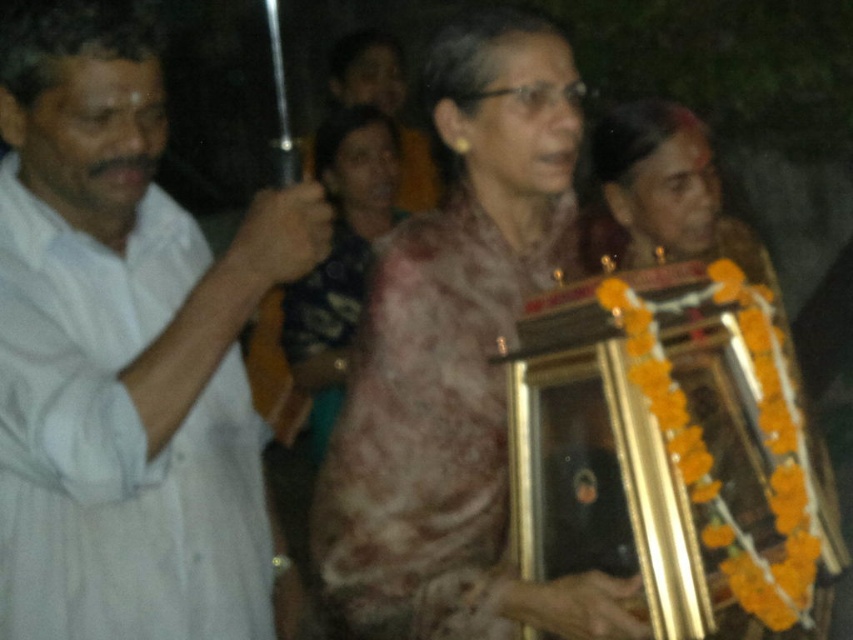
Can you confirm if white cotton shirt at left is positioned to the left of matte pink saree at center?

Yes, white cotton shirt at left is to the left of matte pink saree at center.

Which of these two, white cotton shirt at left or matte pink saree at center, stands taller?

With more height is matte pink saree at center.

Identify the location of white cotton shirt at left. (125, 349).

Locate an element on the screen. white cotton shirt at left is located at coordinates [125, 349].

Does white cotton shirt at left have a smaller size compared to pink floral sari at center?

Actually, white cotton shirt at left might be larger than pink floral sari at center.

Who is lower down, white cotton shirt at left or pink floral sari at center?

white cotton shirt at left is below.

The width and height of the screenshot is (853, 640). What do you see at coordinates (125, 349) in the screenshot? I see `white cotton shirt at left` at bounding box center [125, 349].

Locate an element on the screen. white cotton shirt at left is located at coordinates (125, 349).

Between pink floral sari at center and matte pink saree at center, which one has more height?

With more height is matte pink saree at center.

Does pink floral sari at center appear over matte pink saree at center?

Actually, pink floral sari at center is below matte pink saree at center.

I want to click on pink floral sari at center, so click(x=457, y=362).